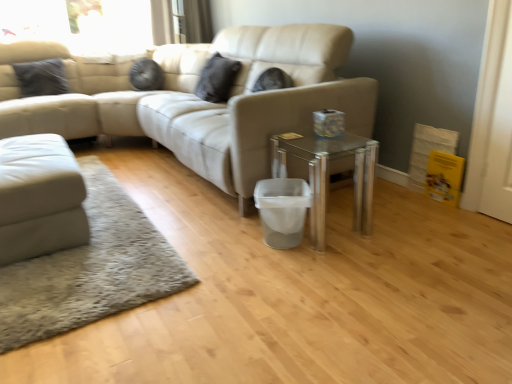
The image size is (512, 384). I want to click on vacant area that is in front of white wood screen door at right, so click(498, 225).